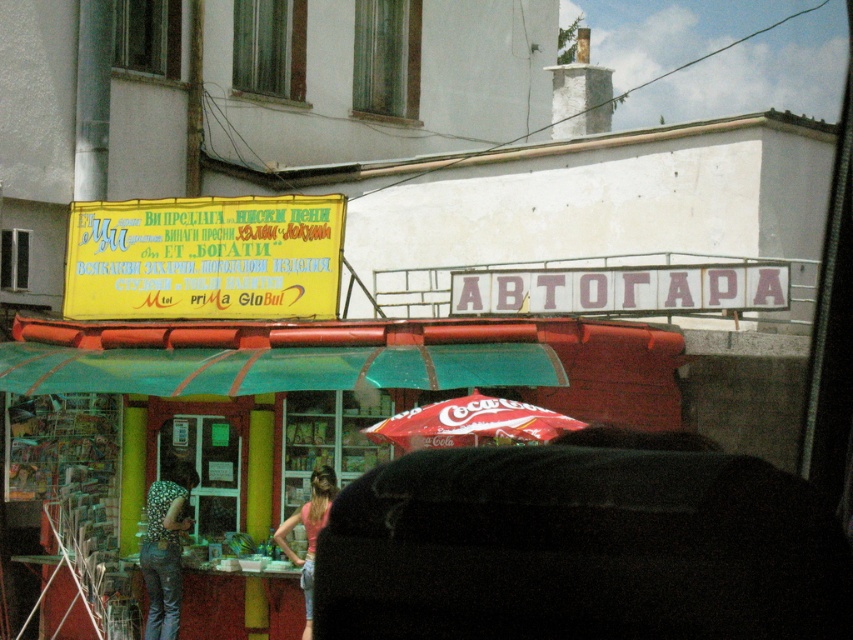
Question: Which is nearer to the red fabric umbrella at center?

Choices:
 (A) floral-patterned fabric at lower left
 (B) pink fabric at center

Answer: (B)

Question: Among these points, which one is nearest to the camera?

Choices:
 (A) (265, 225)
 (B) (421, 416)
 (C) (152, 582)

Answer: (B)

Question: Can you confirm if floral-patterned fabric at lower left is positioned to the left of pink fabric at center?

Choices:
 (A) yes
 (B) no

Answer: (A)

Question: Does yellow matte signboard at upper left have a larger size compared to pink fabric at center?

Choices:
 (A) yes
 (B) no

Answer: (A)

Question: Which of the following is the closest to the observer?

Choices:
 (A) floral-patterned fabric at lower left
 (B) red fabric umbrella at center

Answer: (B)

Question: Can you confirm if red fabric umbrella at center is wider than pink fabric at center?

Choices:
 (A) yes
 (B) no

Answer: (A)